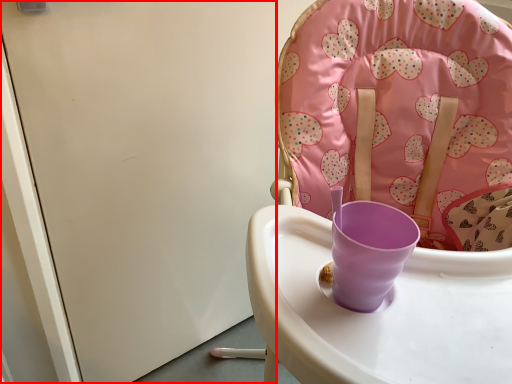
Question: Observing the image, what is the correct spatial positioning of screen door (annotated by the red box) in reference to chair?

Choices:
 (A) left
 (B) right

Answer: (A)